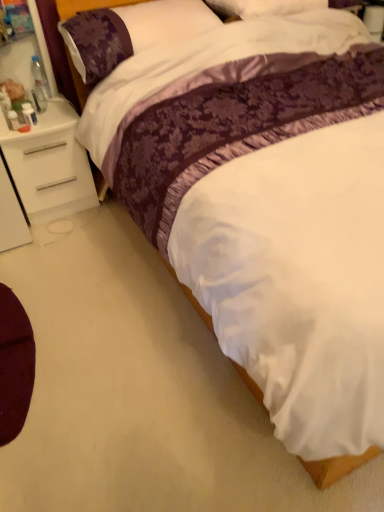
The image size is (384, 512). I want to click on maroon fabric cushion at lower left, so click(14, 365).

Where is `white matte nightstand at left`? white matte nightstand at left is located at coordinates (49, 165).

You are a GUI agent. You are given a task and a screenshot of the screen. Output one action in this format:
    pyautogui.click(x=<x>, y=<y>)
    Task: Click on the plush brown bear at left
    The image size is (384, 512).
    Given the screenshot: What is the action you would take?
    pyautogui.click(x=14, y=93)

This screenshot has height=512, width=384. Find the location of `maroon fabric cushion at lower left`. maroon fabric cushion at lower left is located at coordinates (14, 365).

Between point (103, 11) and point (15, 340), which one is positioned behind?

Point (103, 11)

Looking at this image, does purple satin pillow at upper left have a greater height compared to maroon fabric cushion at lower left?

Yes.

Between plush brown bear at left and purple satin pillow at upper left, which one has less height?

plush brown bear at left is shorter.

Is plush brown bear at left turned away from purple satin pillow at upper left?

No, plush brown bear at left is not facing away from purple satin pillow at upper left.

Can you tell me how much plush brown bear at left and purple satin pillow at upper left differ in facing direction?

The angular difference between plush brown bear at left and purple satin pillow at upper left is 92.8 degrees.

Between plush brown bear at left and purple satin pillow at upper left, which one appears on the left side from the viewer's perspective?

plush brown bear at left.

Considering the relative sizes of maroon fabric cushion at lower left and plush brown bear at left in the image provided, is maroon fabric cushion at lower left wider than plush brown bear at left?

Correct, the width of maroon fabric cushion at lower left exceeds that of plush brown bear at left.

Is maroon fabric cushion at lower left far away from plush brown bear at left?

Absolutely, maroon fabric cushion at lower left is distant from plush brown bear at left.

Considering the points (11, 291) and (22, 94), which point is in front, point (11, 291) or point (22, 94)?

The point (11, 291) is closer.

Who is more distant, maroon fabric cushion at lower left or plush brown bear at left?

plush brown bear at left is behind.

Is white matte nightstand at left inside purple satin pillow at upper left?

No, white matte nightstand at left is located outside of purple satin pillow at upper left.

Which is behind, point (197, 15) or point (36, 215)?

Positioned behind is point (36, 215).

Could you tell me if purple satin pillow at upper left is turned towards white matte nightstand at left?

No, purple satin pillow at upper left is not turned towards white matte nightstand at left.

Does purple satin pillow at upper left have a greater width compared to white matte nightstand at left?

Yes.

From a real-world perspective, relative to plush brown bear at left, is white matte nightstand at left vertically above or below?

From a real-world perspective, white matte nightstand at left is physically below plush brown bear at left.

Looking at the image, does white matte nightstand at left seem bigger or smaller compared to plush brown bear at left?

In the image, white matte nightstand at left appears to be larger than plush brown bear at left.

Considering the sizes of objects white matte nightstand at left and plush brown bear at left in the image provided, who is shorter, white matte nightstand at left or plush brown bear at left?

plush brown bear at left.

Based on their positions, is white matte nightstand at left located to the left or right of plush brown bear at left?

From the image, it's evident that white matte nightstand at left is to the right of plush brown bear at left.

Which of these two, maroon fabric cushion at lower left or purple satin pillow at upper left, is bigger?

With larger size is purple satin pillow at upper left.

Are maroon fabric cushion at lower left and purple satin pillow at upper left far apart?

maroon fabric cushion at lower left is positioned a significant distance from purple satin pillow at upper left.

From a real-world perspective, which is physically above, maroon fabric cushion at lower left or purple satin pillow at upper left?

purple satin pillow at upper left, from a real-world perspective.

Is maroon fabric cushion at lower left wider than purple satin pillow at upper left?

In fact, maroon fabric cushion at lower left might be narrower than purple satin pillow at upper left.

Does point (9, 362) lie behind point (55, 211)?

No, (9, 362) is closer to viewer.

From a real-world perspective, who is located lower, maroon fabric cushion at lower left or white matte nightstand at left?

In real-world perspective, maroon fabric cushion at lower left is lower.

Which object is positioned more to the right, maroon fabric cushion at lower left or white matte nightstand at left?

maroon fabric cushion at lower left.

What are the coordinates of `swivel chair that is below the purple satin pillow at upper left (from the image's perspective)` in the screenshot? It's located at [x=14, y=365].

Image resolution: width=384 pixels, height=512 pixels. In the image, there is a purple satin pillow at upper left. What are the coordinates of `toy below it (from a real-world perspective)` in the screenshot? It's located at (14, 93).

Considering their positions, is white matte nightstand at left positioned closer to purple satin pillow at upper left than maroon fabric cushion at lower left?

Among the two, white matte nightstand at left is located nearer to purple satin pillow at upper left.

From the image, which object appears to be nearer to purple satin pillow at upper left, maroon fabric cushion at lower left or white matte nightstand at left?

The object closer to purple satin pillow at upper left is white matte nightstand at left.

Looking at the image, which one is located closer to maroon fabric cushion at lower left, plush brown bear at left or white matte nightstand at left?

white matte nightstand at left.

When comparing their distances from plush brown bear at left, does maroon fabric cushion at lower left or purple satin pillow at upper left seem further?

maroon fabric cushion at lower left is further to plush brown bear at left.

Based on the photo, estimate the real-world distances between objects in this image. Which object is closer to white matte nightstand at left, maroon fabric cushion at lower left or plush brown bear at left?

plush brown bear at left.

Considering their positions, is white matte nightstand at left positioned closer to maroon fabric cushion at lower left than purple satin pillow at upper left?

white matte nightstand at left is closer to maroon fabric cushion at lower left.

Which object lies further to the anchor point purple satin pillow at upper left, maroon fabric cushion at lower left or plush brown bear at left?

Based on the image, maroon fabric cushion at lower left appears to be further to purple satin pillow at upper left.

Considering their positions, is maroon fabric cushion at lower left positioned further to plush brown bear at left than white matte nightstand at left?

maroon fabric cushion at lower left lies further to plush brown bear at left than the other object.

Locate an element on the screen. The height and width of the screenshot is (512, 384). nightstand between plush brown bear at left and maroon fabric cushion at lower left vertically is located at coordinates (49, 165).

What are the coordinates of `toy between purple satin pillow at upper left and maroon fabric cushion at lower left from top to bottom` in the screenshot? It's located at pyautogui.click(x=14, y=93).

Image resolution: width=384 pixels, height=512 pixels. I want to click on nightstand between plush brown bear at left and purple satin pillow at upper left from left to right, so click(49, 165).

The image size is (384, 512). I want to click on nightstand between purple satin pillow at upper left and maroon fabric cushion at lower left in the up-down direction, so click(x=49, y=165).